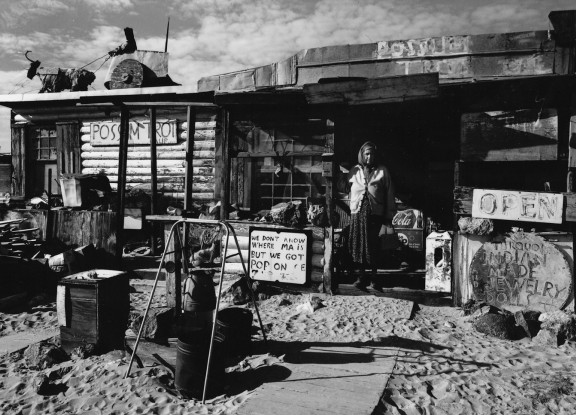
The height and width of the screenshot is (415, 576). In order to click on open sign in this screenshot , I will do `click(515, 209)`.